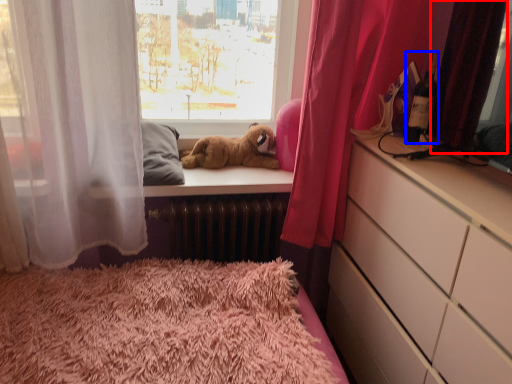
Question: Which object is closer to the camera taking this photo, curtain (highlighted by a red box) or bottle (highlighted by a blue box)?

Choices:
 (A) curtain
 (B) bottle

Answer: (A)